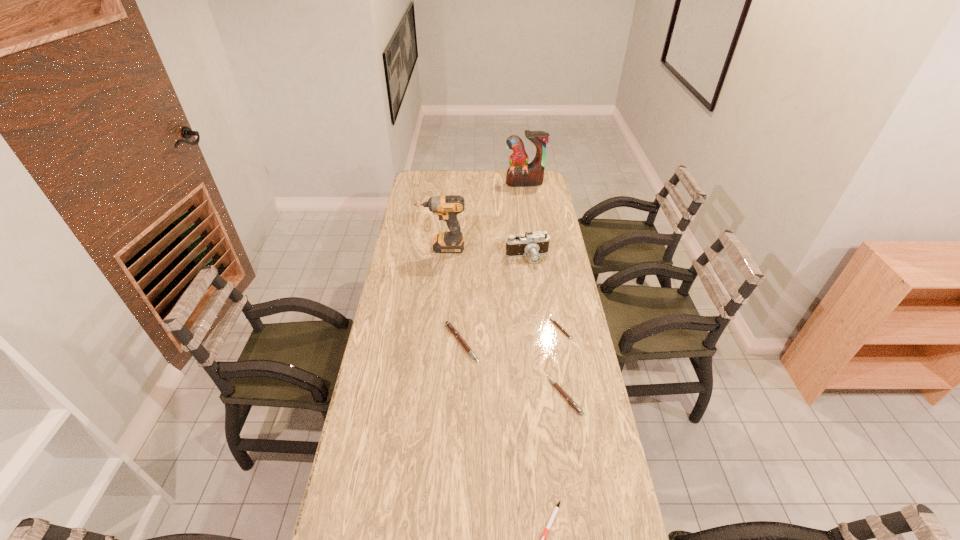
The height and width of the screenshot is (540, 960). Find the location of `vacant area that lies between the smallest pink pen and the farthest object`. vacant area that lies between the smallest pink pen and the farthest object is located at coordinates (542, 255).

You are a GUI agent. You are given a task and a screenshot of the screen. Output one action in this format:
    pyautogui.click(x=<x>, y=<y>)
    Task: Click on the vacant space that is in between the third tallest object and the fifth tallest object
    Image resolution: width=960 pixels, height=540 pixels.
    Given the screenshot: What is the action you would take?
    pyautogui.click(x=546, y=327)

Identify which object is the third nearest to the fifth shortest object. Please provide its 2D coordinates. Your answer should be formatted as a tuple, i.e. [(x, y)], where the tuple contains the x and y coordinates of a point satisfying the conditions above.

[(448, 324)]

Locate which object ranks third in proximity to the drill. Please provide its 2D coordinates. Your answer should be formatted as a tuple, i.e. [(x, y)], where the tuple contains the x and y coordinates of a point satisfying the conditions above.

[(563, 330)]

Identify the location of pen that is the third closest one to the parrot. (571, 402).

Identify which pen is located as the nearest to the drill. Please provide its 2D coordinates. Your answer should be formatted as a tuple, i.e. [(x, y)], where the tuple contains the x and y coordinates of a point satisfying the conditions above.

[(448, 324)]

Image resolution: width=960 pixels, height=540 pixels. In order to click on pink pen that is the third closest to the fifth shortest object in this screenshot , I will do `click(571, 402)`.

Find the location of a particular element. pink pen that is the third closest to the fifth shortest object is located at coordinates (571, 402).

You are a GUI agent. You are given a task and a screenshot of the screen. Output one action in this format:
    pyautogui.click(x=<x>, y=<y>)
    Task: Click on the blank area in the image that satisfies the following two spatial constraints: 1. at the face of the parrot; 2. at the nib of the leftmost pink pen
    The width and height of the screenshot is (960, 540).
    Given the screenshot: What is the action you would take?
    pyautogui.click(x=548, y=343)